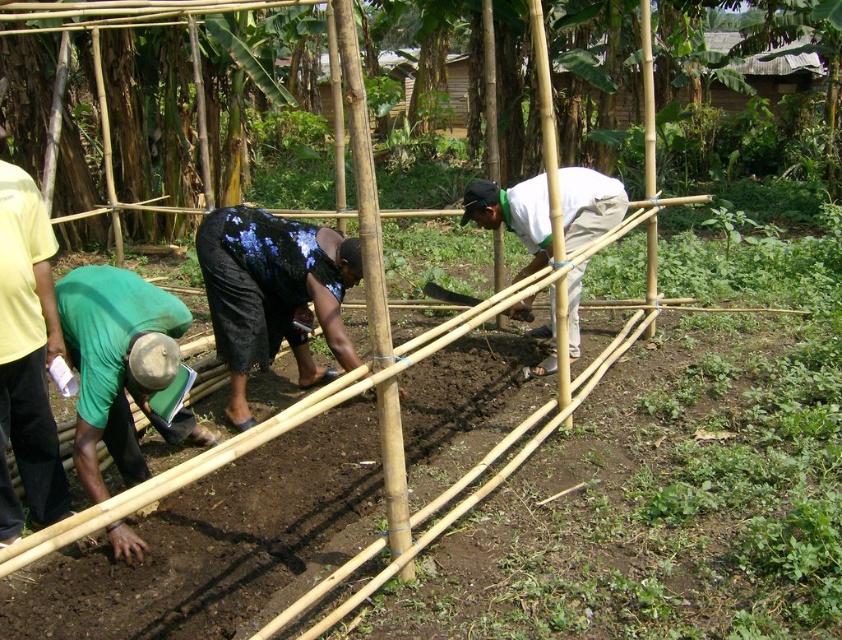
You are standing in the middle of the scene and want to move towards the two points marked in the image. Which point, point (155,296) or point (46,422), is closer to you?

Point (155,296) is closer to you because it is further to the viewer than point (46,422).

You are a farmer standing near the bamboo structure in the foreground. You need to reach both the green fabric shirt at left and the smooth wooden shovel at center. Given that your maximum reach without moving is 2 meters, can you comfortably access both items without moving from your current position?

The green fabric shirt at left and smooth wooden shovel at center are 2.70 meters apart. Since your maximum reach is 2 meters, you cannot comfortably access both items without moving from your current position.